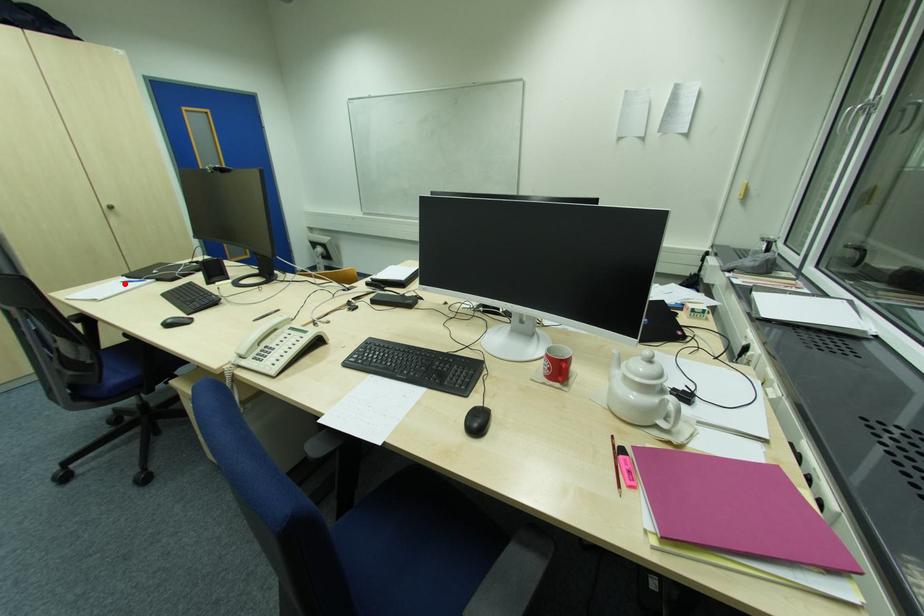
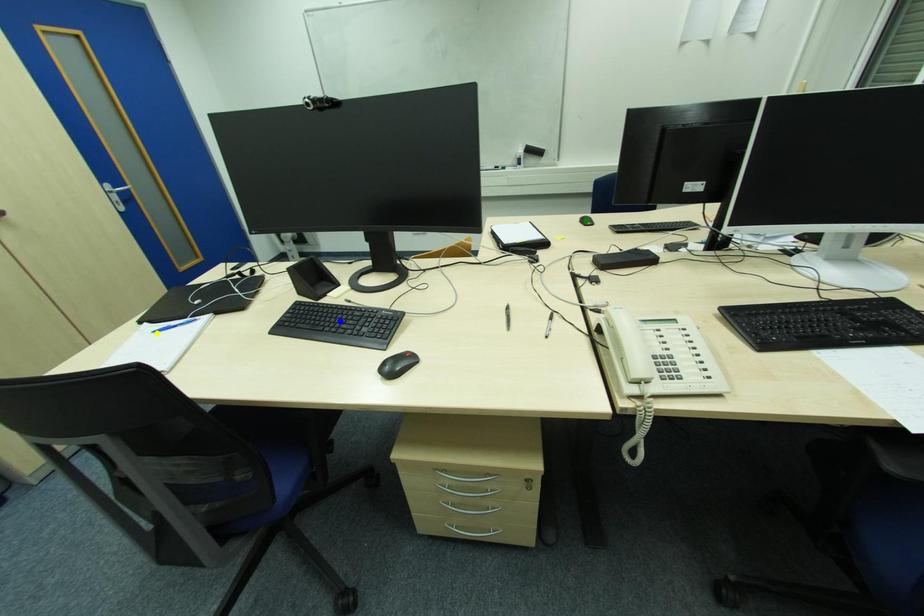
Question: I am providing you with two images of the same scene from different viewpoints. A red point is marked on the first image. You are given multiple points on the second image. Which spot in image 2 lines up with the point in image 1?

Choices:
 (A) blue point
 (B) yellow point
 (C) green point

Answer: (B)